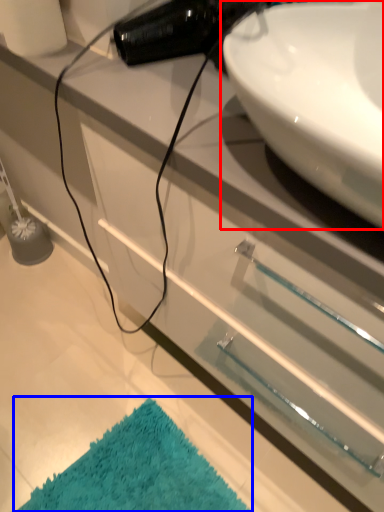
Question: Which of the following is the closest to the observer, sink (highlighted by a red box) or bath mat (highlighted by a blue box)?

Choices:
 (A) sink
 (B) bath mat

Answer: (A)